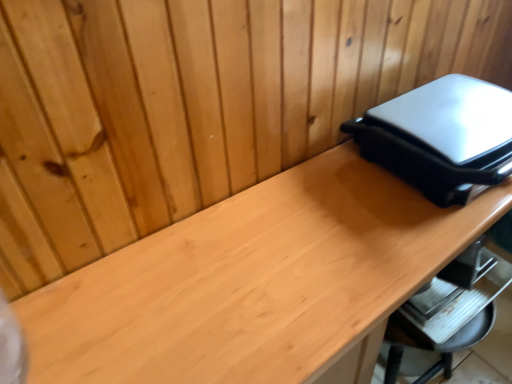
The image size is (512, 384). What are the coordinates of `vacant space situated on the left part of satin black appliance at upper right` in the screenshot? It's located at (316, 218).